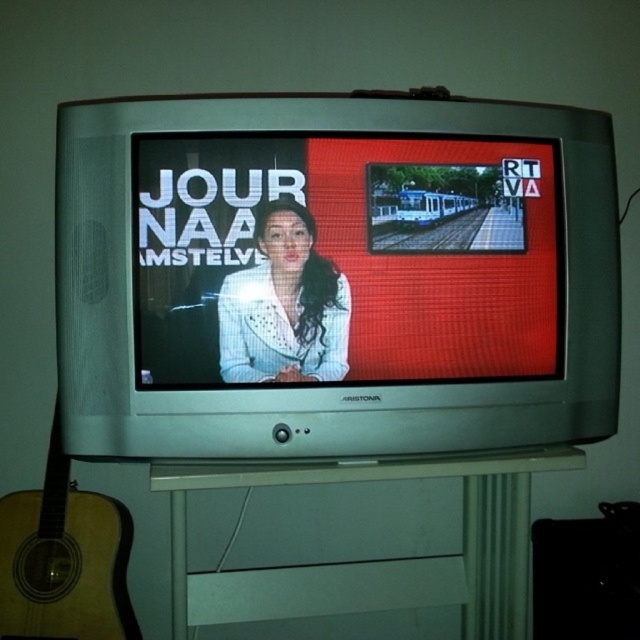
Question: Can you confirm if matte white jacket at center is smaller than acoustic wood guitar at left?

Choices:
 (A) yes
 (B) no

Answer: (A)

Question: Among these points, which one is farthest from the camera?

Choices:
 (A) (355, 321)
 (B) (260, 280)

Answer: (A)

Question: Which point is closer to the camera?

Choices:
 (A) (44, 630)
 (B) (340, 358)

Answer: (B)

Question: Is matte white jacket at center smaller than white textured blazer at center?

Choices:
 (A) no
 (B) yes

Answer: (A)

Question: Does acoustic wood guitar at left appear on the left side of white textured blazer at center?

Choices:
 (A) no
 (B) yes

Answer: (B)

Question: Which point is closer to the camera?

Choices:
 (A) (328, 300)
 (B) (10, 556)
 (C) (157, 340)

Answer: (C)